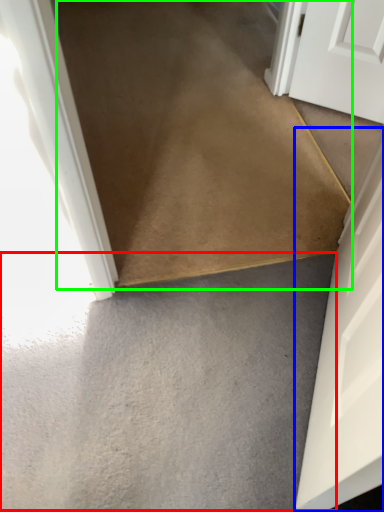
Question: Which object is the closest to the concrete (highlighted by a red box)? Choose among these: door (highlighted by a blue box) or path (highlighted by a green box).

Choices:
 (A) door
 (B) path

Answer: (A)